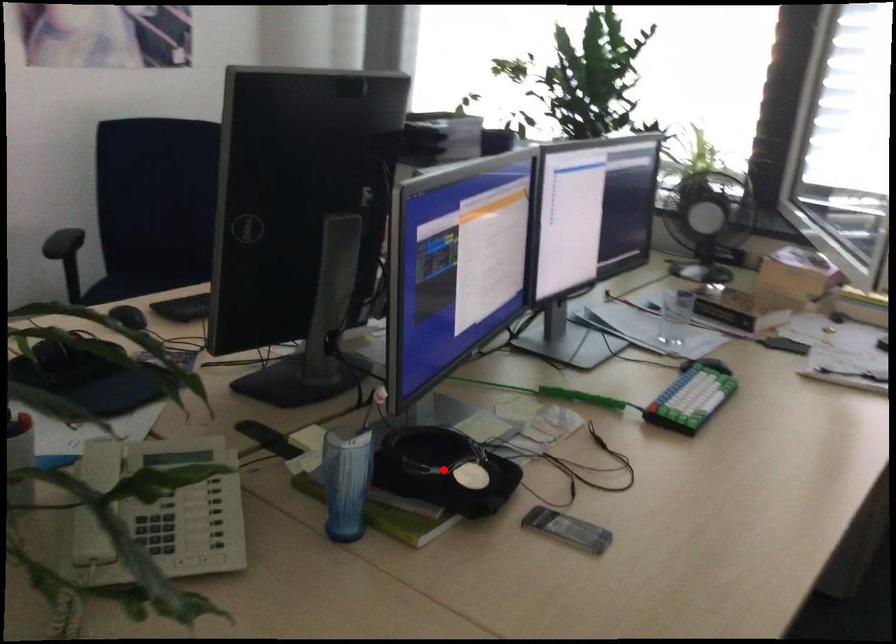
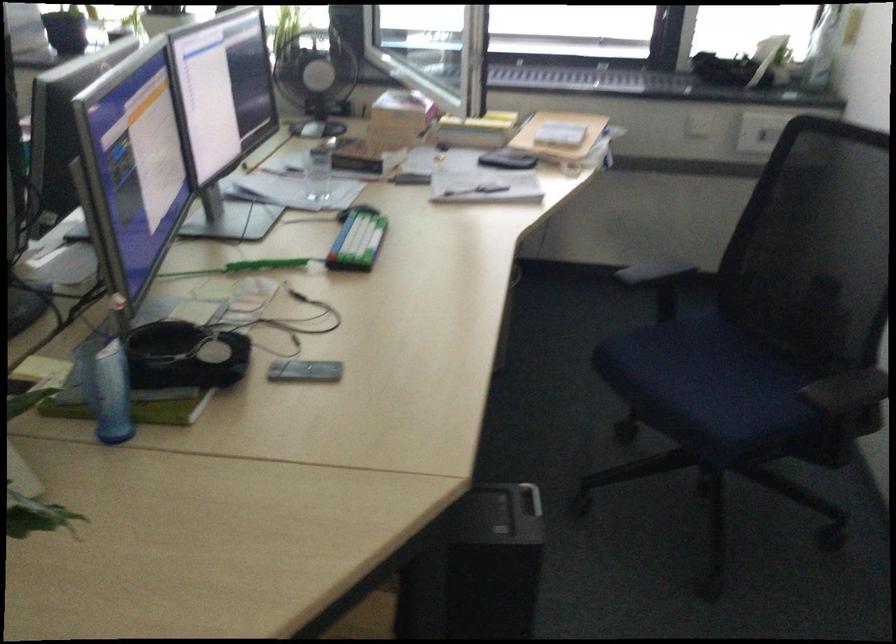
Question: I am providing you with two images of the same scene from different viewpoints. A red point is shown in image1. For the corresponding object point in image2, is it positioned nearer or farther from the camera?

Choices:
 (A) Nearer
 (B) Farther

Answer: (B)